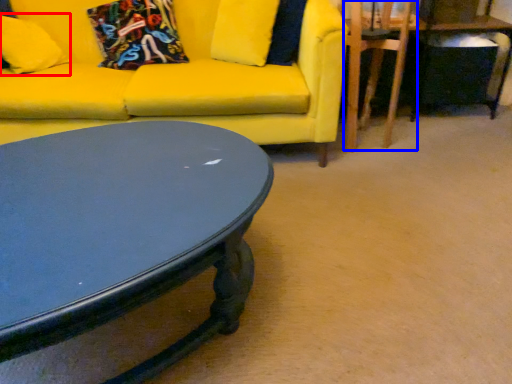
Question: Which of the following is the closest to the observer, pillow (highlighted by a red box) or swivel chair (highlighted by a blue box)?

Choices:
 (A) pillow
 (B) swivel chair

Answer: (B)